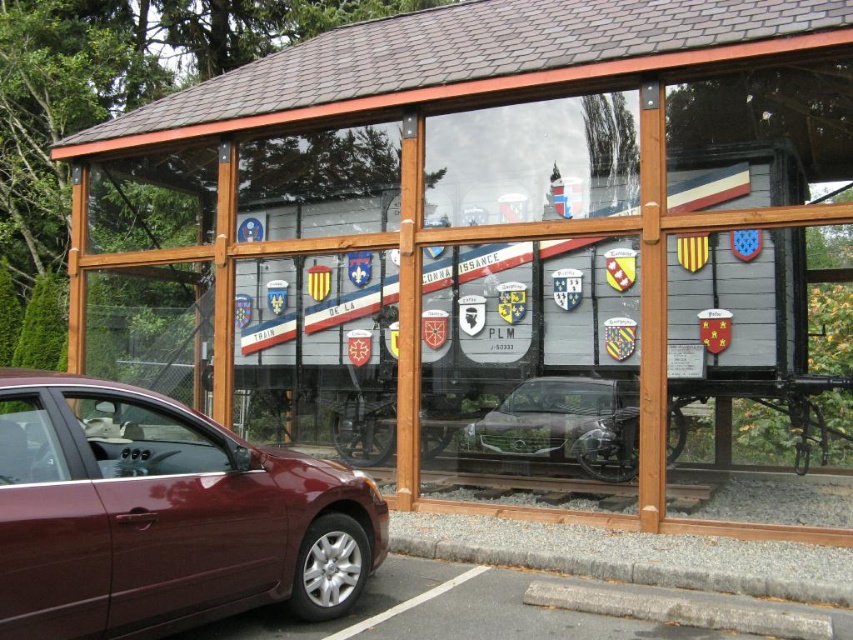
You are a photographer wanting to capture the entire scene of the satin silver car at center. You notice the gray asphalt at lower left in the frame. Considering their sizes, which object would you need to adjust your camera angle to focus more on the larger one?

The satin silver car at center is larger than the gray asphalt at lower left, so you should adjust your camera angle to focus more on the satin silver car at center.

You are a visitor standing at the entrance of the display area and want to take a photo of the satin burgundy sedan at lower left and the gray asphalt at lower left. Which object will appear bigger in your photo?

The satin burgundy sedan at lower left is larger in size than the gray asphalt at lower left, so it will appear bigger in the photo.

You are a maintenance worker needing to reach a point 4.95 meters away from your current position at point (349,545). Can you safely walk there without any obstacles?

The distance between your current position at point (349,545) and the target point is 4.95 meters. Since there are no obstacles mentioned in the scene description, you can safely walk there.